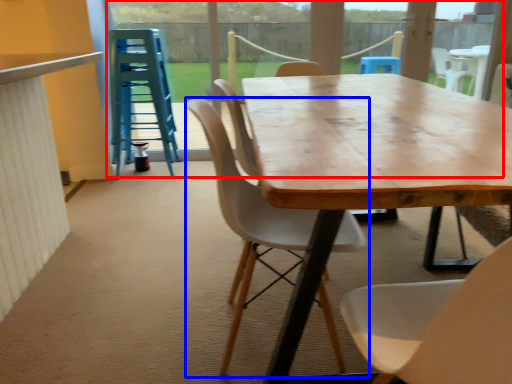
Question: Which object is further to the camera taking this photo, glass door (highlighted by a red box) or chair (highlighted by a blue box)?

Choices:
 (A) glass door
 (B) chair

Answer: (A)